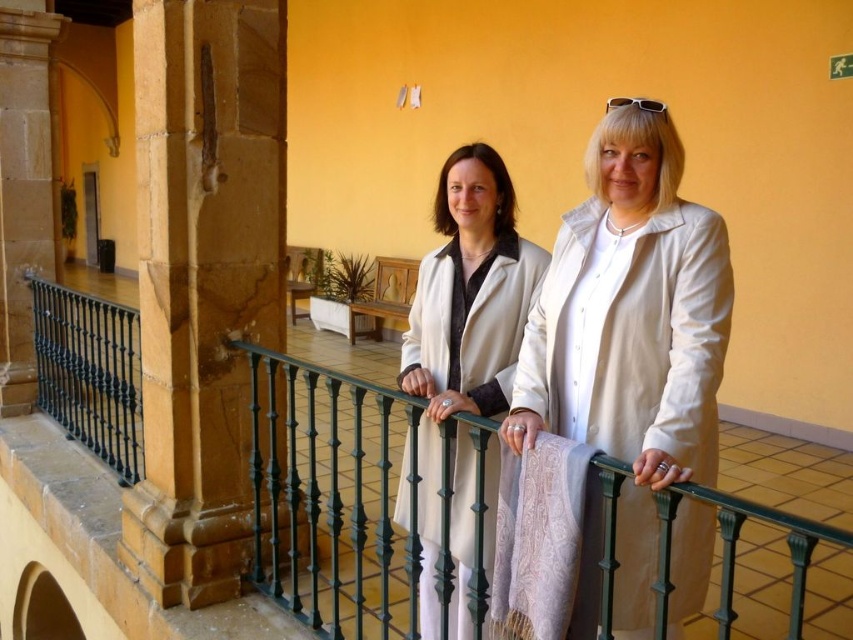
You are standing on the balcony looking at the point marked as point [196,580]. If you want to reach this point without moving your feet, can you stretch your hand to touch it?

The point [196,580] is 3.08 meters from the viewer, so you cannot stretch your hand to touch it without moving your feet.